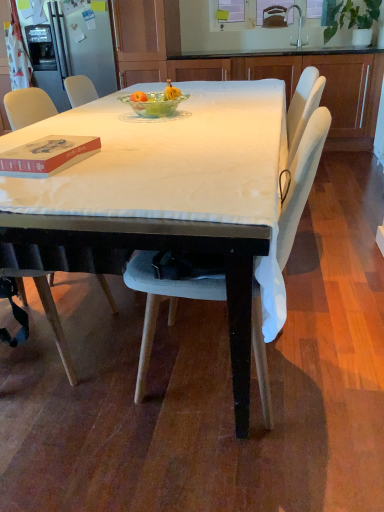
Question: Can you confirm if silver metallic faucet at upper center is wider than matte red book at left?

Choices:
 (A) yes
 (B) no

Answer: (B)

Question: Does silver metallic faucet at upper center have a lesser width compared to matte red book at left?

Choices:
 (A) yes
 (B) no

Answer: (A)

Question: Is silver metallic faucet at upper center positioned before matte red book at left?

Choices:
 (A) yes
 (B) no

Answer: (B)

Question: Is silver metallic faucet at upper center far away from matte red book at left?

Choices:
 (A) no
 (B) yes

Answer: (B)

Question: From the image's perspective, is silver metallic faucet at upper center under matte red book at left?

Choices:
 (A) no
 (B) yes

Answer: (A)

Question: Is green leafy plant at upper right in front of or behind light gray fabric chair at center in the image?

Choices:
 (A) front
 (B) behind

Answer: (B)

Question: From their relative heights in the image, would you say green leafy plant at upper right is taller or shorter than light gray fabric chair at center?

Choices:
 (A) short
 (B) tall

Answer: (A)

Question: Based on their positions, is green leafy plant at upper right located to the left or right of light gray fabric chair at center?

Choices:
 (A) left
 (B) right

Answer: (B)

Question: From a real-world perspective, relative to light gray fabric chair at center, is green leafy plant at upper right vertically above or below?

Choices:
 (A) below
 (B) above

Answer: (B)

Question: Considering the positions of silver metallic faucet at upper center and white wood cabinets at center in the image, is silver metallic faucet at upper center taller or shorter than white wood cabinets at center?

Choices:
 (A) short
 (B) tall

Answer: (A)

Question: Considering the positions of point (299, 46) and point (365, 134), is point (299, 46) closer or farther from the camera than point (365, 134)?

Choices:
 (A) farther
 (B) closer

Answer: (A)

Question: From the image's perspective, relative to white wood cabinets at center, is silver metallic faucet at upper center above or below?

Choices:
 (A) below
 (B) above

Answer: (B)

Question: Is silver metallic faucet at upper center in front of or behind white wood cabinets at center in the image?

Choices:
 (A) behind
 (B) front

Answer: (A)

Question: Do you think green leafy plant at upper right is within silver metallic faucet at upper center, or outside of it?

Choices:
 (A) outside
 (B) inside

Answer: (A)

Question: In terms of height, does green leafy plant at upper right look taller or shorter compared to silver metallic faucet at upper center?

Choices:
 (A) short
 (B) tall

Answer: (B)